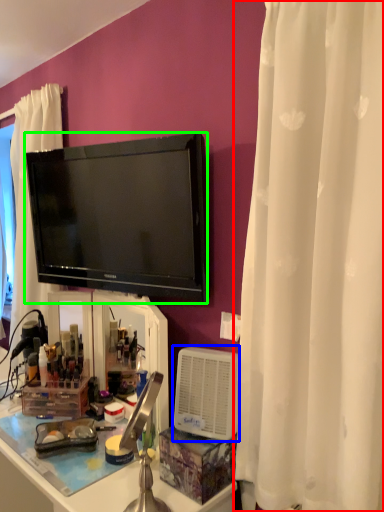
Question: Based on their relative distances, which object is farther from curtain (highlighted by a red box)? Choose from appliance (highlighted by a blue box) and television (highlighted by a green box).

Choices:
 (A) appliance
 (B) television

Answer: (B)